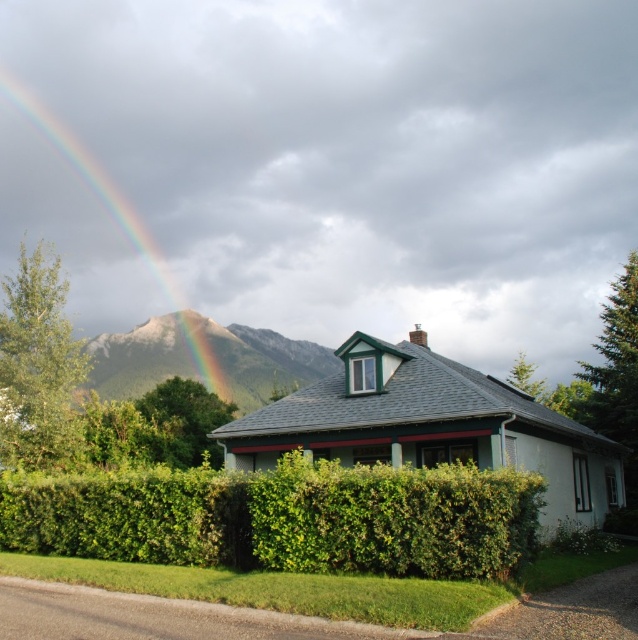
Question: Can you confirm if green leafy hedge at center is positioned below rainbow at upper left?

Choices:
 (A) yes
 (B) no

Answer: (A)

Question: Which point is farther to the camera?

Choices:
 (A) (138, 250)
 (B) (218, 474)
 (C) (255, 376)

Answer: (A)

Question: Which point is farther from the camera taking this photo?

Choices:
 (A) (135, 394)
 (B) (3, 531)

Answer: (A)

Question: Does green leafy hedge at center have a greater width compared to rugged granite mountain at upper left?

Choices:
 (A) no
 (B) yes

Answer: (A)

Question: Is green leafy hedge at center wider than rugged granite mountain at upper left?

Choices:
 (A) no
 (B) yes

Answer: (A)

Question: Which is farther from the green leafy hedge at center?

Choices:
 (A) rugged granite mountain at upper left
 (B) rainbow at upper left

Answer: (B)